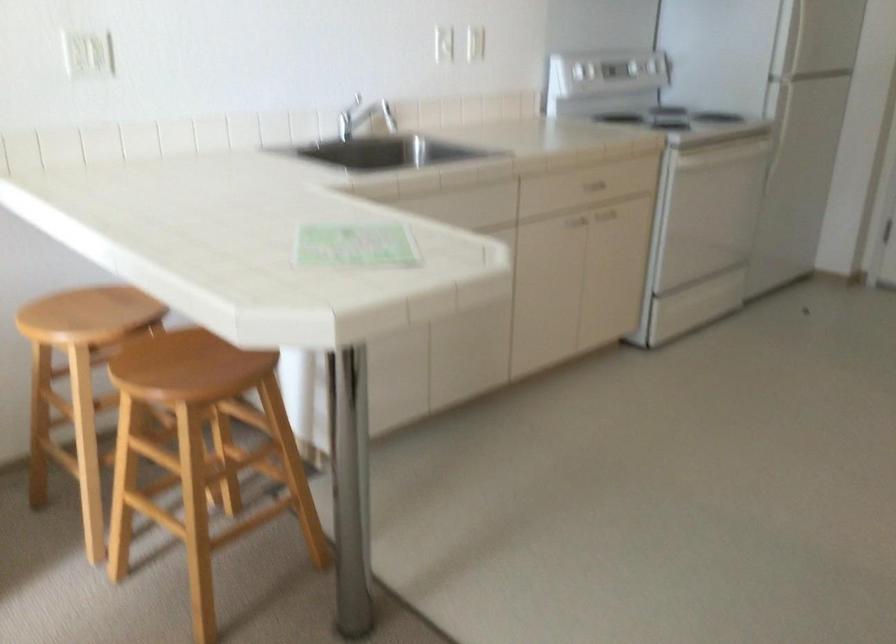
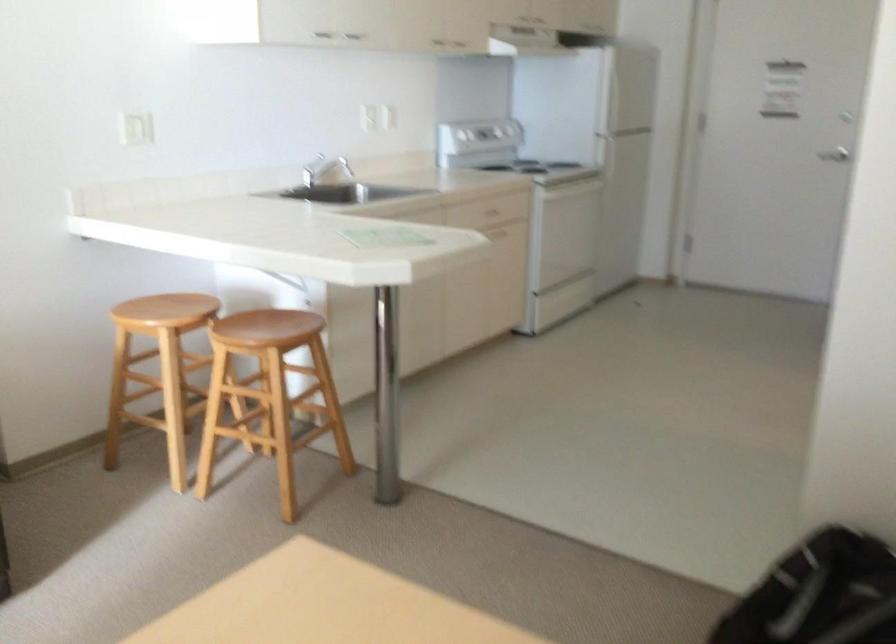
Question: I am providing you with two images of the same scene from different viewpoints. Please identify which objects are invisible in image2.

Choices:
 (A) silver cabinet handle
 (B) white refrigerator handle
 (C) chair sitting surface
 (D) none of these

Answer: (D)